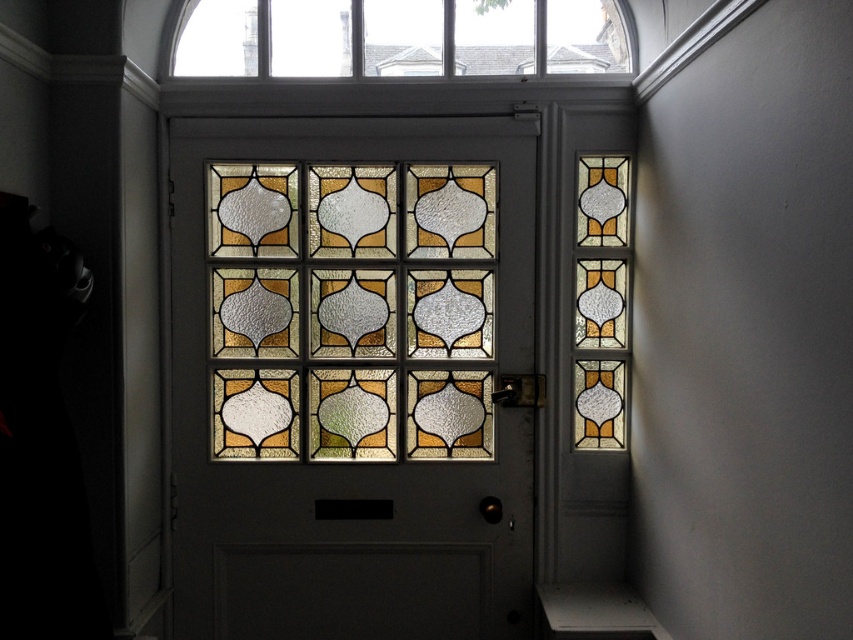
Question: Estimate the real-world distances between objects in this image. Which object is farther from the clear glass window at upper center?

Choices:
 (A) stained glass window at center
 (B) translucent stained glass at center

Answer: (A)

Question: Does stained glass window at center have a greater width compared to translucent stained glass at center?

Choices:
 (A) no
 (B) yes

Answer: (B)

Question: Does stained glass window at center appear over translucent stained glass at center?

Choices:
 (A) no
 (B) yes

Answer: (A)

Question: Which of these objects is positioned closest to the translucent stained glass at center?

Choices:
 (A) stained glass window at center
 (B) clear glass window at upper center

Answer: (A)

Question: Is translucent stained glass at center positioned in front of clear glass window at upper center?

Choices:
 (A) no
 (B) yes

Answer: (B)

Question: Which object is closer to the camera taking this photo?

Choices:
 (A) translucent stained glass at center
 (B) stained glass window at center

Answer: (B)